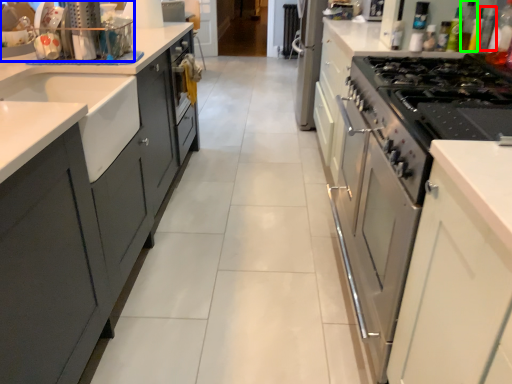
Question: Which is farther away from bottle (highlighted by a red box)? kitchen appliance (highlighted by a blue box) or bottle (highlighted by a green box)?

Choices:
 (A) kitchen appliance
 (B) bottle

Answer: (A)